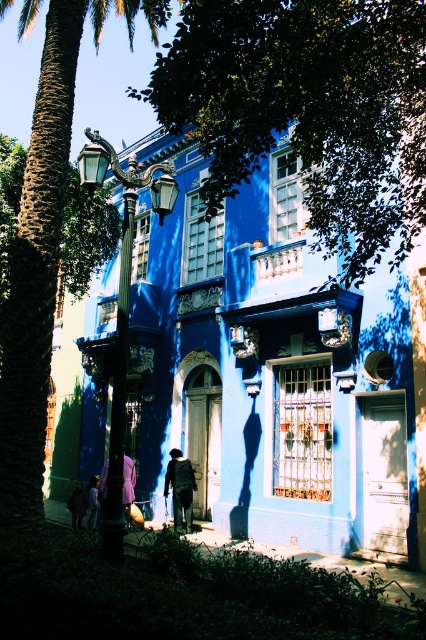
You are standing on the sidewalk in front of the blue building and see the green leafy tree at upper center and the dark blue fabric jacket at center. Which object is higher up in the scene?

The green leafy tree at upper center is positioned over the dark blue fabric jacket at center, so it is higher up in the scene.